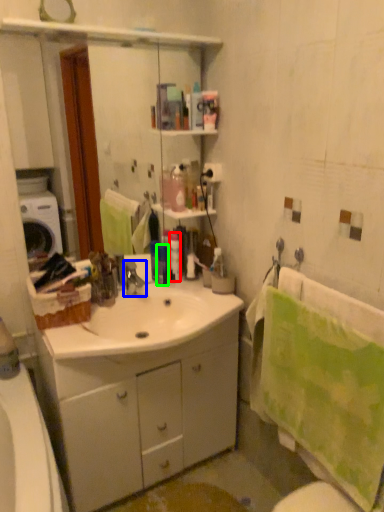
Question: Which object is positioned farthest from toiletry (highlighted by a red box)? Select from tap (highlighted by a blue box) and toiletry (highlighted by a green box).

Choices:
 (A) tap
 (B) toiletry

Answer: (A)